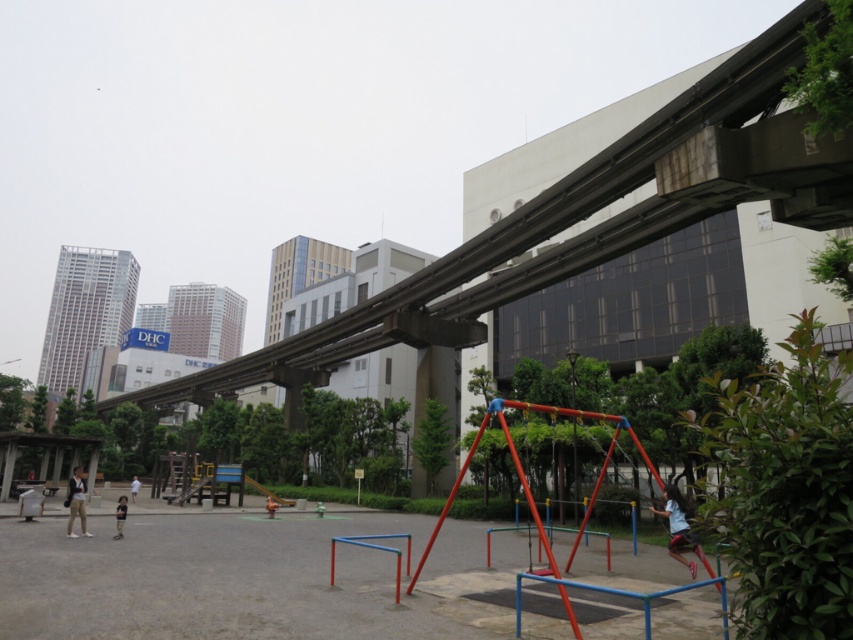
Question: Which object appears closest to the camera in this image?

Choices:
 (A) white cotton shirt at center
 (B) light blue fabric swing at center
 (C) matte gray jacket at lower left

Answer: (B)

Question: Can you confirm if light blue fabric swing at center is positioned to the right of light brown wooden toy at lower left?

Choices:
 (A) no
 (B) yes

Answer: (B)

Question: Which object is positioned farthest from the white cotton shirt at center?

Choices:
 (A) light blue fabric swing at center
 (B) matte gray jacket at lower left

Answer: (A)

Question: Which object is closer to the camera taking this photo?

Choices:
 (A) matte gray jacket at lower left
 (B) light blue fabric swing at center
 (C) light brown wooden toy at lower left

Answer: (B)

Question: Does matte gray jacket at lower left lie in front of light brown wooden toy at lower left?

Choices:
 (A) no
 (B) yes

Answer: (B)

Question: Does matte gray jacket at lower left appear over light brown wooden toy at lower left?

Choices:
 (A) yes
 (B) no

Answer: (A)